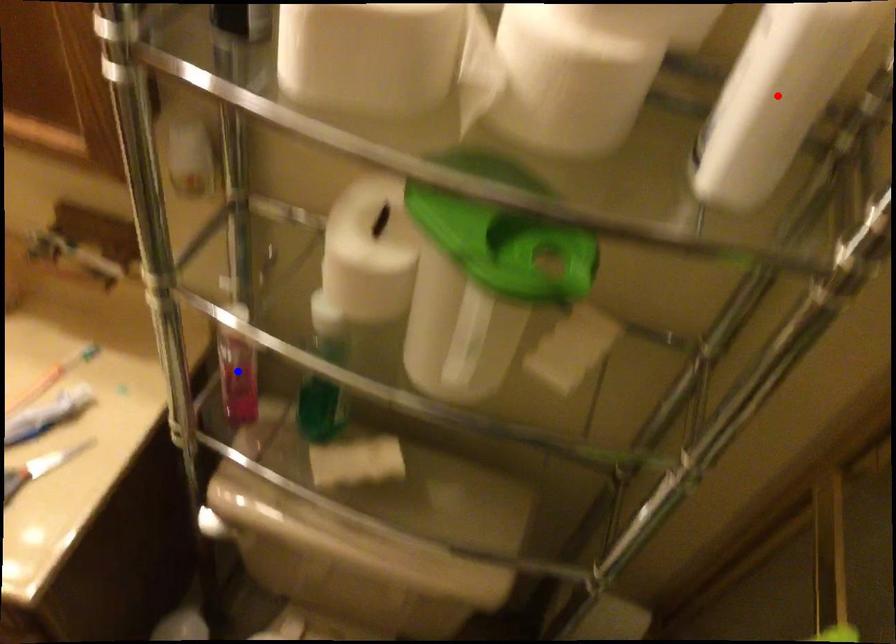
Question: Which of the two points in the image is closer to the camera?

Choices:
 (A) Blue point is closer.
 (B) Red point is closer.

Answer: (B)